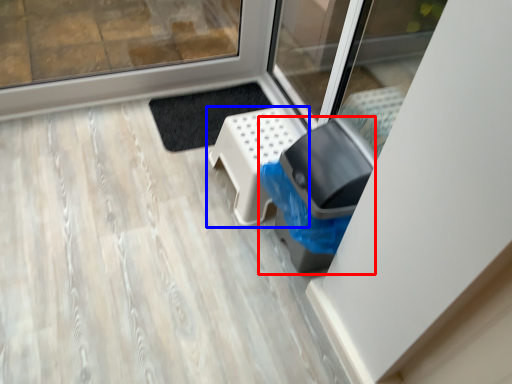
Question: Which point is closer to the camera, garbage (highlighted by a red box) or furniture (highlighted by a blue box)?

Choices:
 (A) garbage
 (B) furniture

Answer: (A)